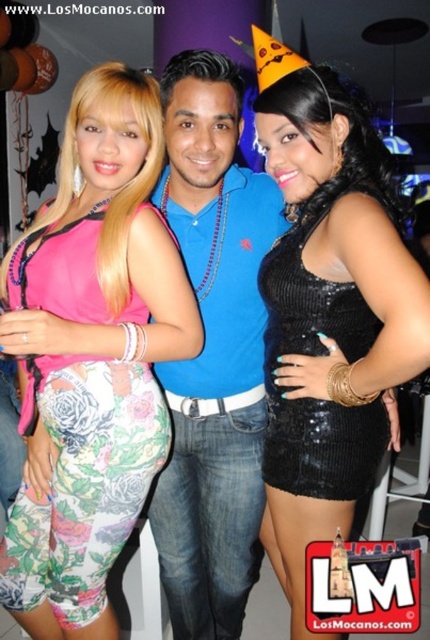
You are standing at the origin point of the image coordinate system. You want to move towards the black sequined dress at center. What direction should you move in?

Since the black sequined dress at center is located at point 0.495 in the x direction and 0.767 in the y direction, you should move towards the center of the image to reach it.

You are a photographer at a party and want to ensure that the floral leggings at center and the black sequined dress at right are both visible in your portrait. Given their widths, which one might require you to adjust your camera angle to avoid being cropped out?

The floral leggings at center are wider than the black sequined dress at right, so you might need to adjust the camera angle to accommodate the wider floral leggings at center to prevent cropping.

You are a photographer trying to capture a closeup of the floral leggings at center and the black sequined dress at center. Which one should you focus on first if you want to ensure both are in focus?

The floral leggings at center is below the black sequined dress at center, so you should focus on the black sequined dress at center first to ensure both are in focus since it is closer to the camera.